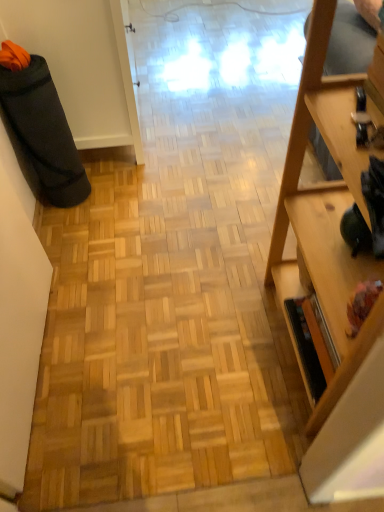
Where is `free space to the right of black fabric bag at left`? This screenshot has height=512, width=384. free space to the right of black fabric bag at left is located at coordinates (114, 187).